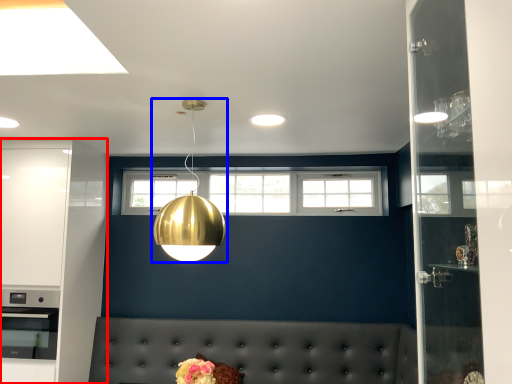
Question: Which of the following is the farthest to the observer, cabinetry (highlighted by a red box) or lamp (highlighted by a blue box)?

Choices:
 (A) cabinetry
 (B) lamp

Answer: (A)